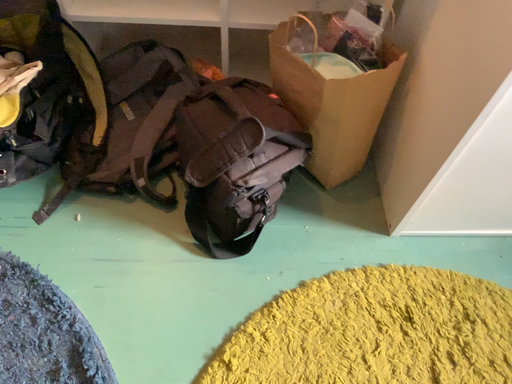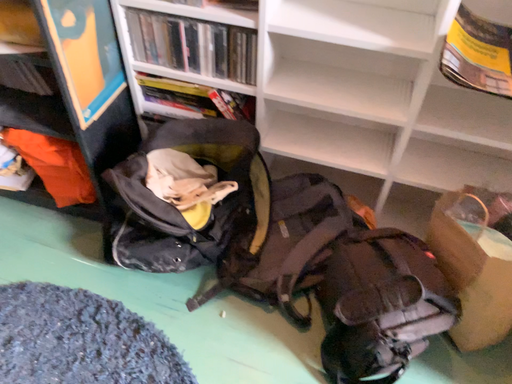
Question: Which way did the camera rotate in the video?

Choices:
 (A) rotated left
 (B) rotated right

Answer: (A)